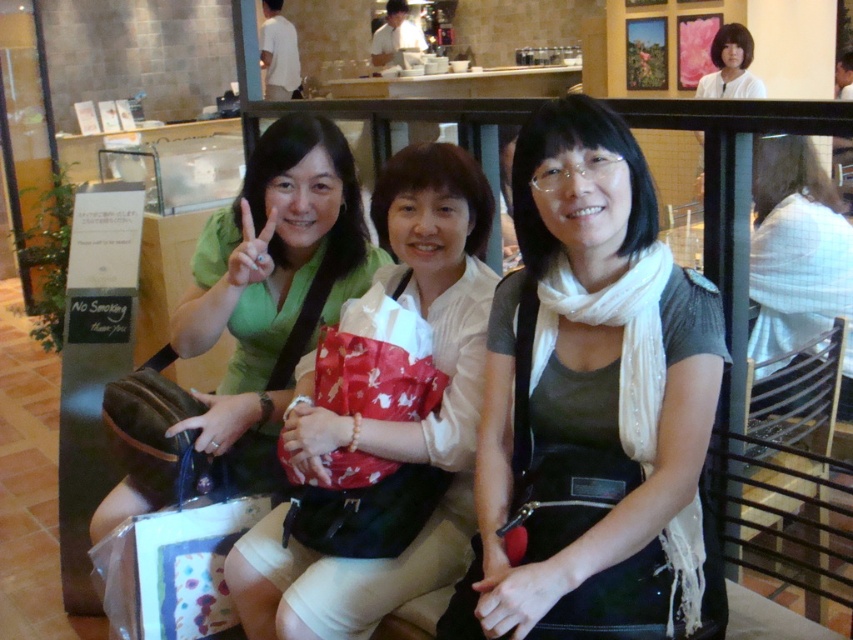
Can you confirm if matte green blouse at center is bigger than white fabric shirt at upper right?

Actually, matte green blouse at center might be smaller than white fabric shirt at upper right.

Who is more distant from viewer, (x=329, y=451) or (x=798, y=301)?

Point (x=798, y=301)

What do you see at coordinates (387, 420) in the screenshot?
I see `matte green blouse at center` at bounding box center [387, 420].

I want to click on matte green blouse at center, so click(387, 420).

Between white satin scarf at center and white fabric shirt at upper right, which one is positioned higher?

white fabric shirt at upper right is higher up.

Does white satin scarf at center have a smaller size compared to white fabric shirt at upper right?

Yes.

Is point (642, 305) in front of point (788, 202)?

Yes, it is.

Where is `white satin scarf at center`? white satin scarf at center is located at coordinates (590, 403).

Which is below, white satin scarf at center or matte green blouse at center?

matte green blouse at center

Measure the distance between point [543,396] and camera.

Point [543,396] is 1.41 meters away from camera.

Where is `white satin scarf at center`? The image size is (853, 640). white satin scarf at center is located at coordinates (590, 403).